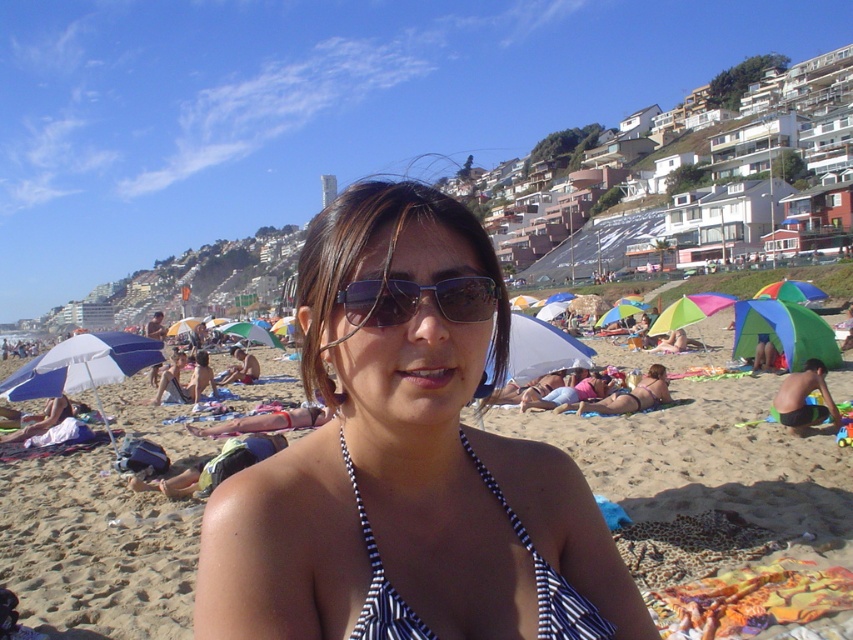
You are standing at point [407,461] on the beach. What object is located exactly at this point?

The black striped bikini top at center is located exactly at point [407,461].